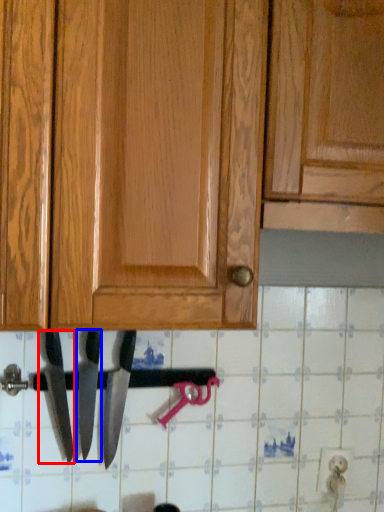
Question: Which of the following is the closest to the observer, knife (highlighted by a red box) or knife (highlighted by a blue box)?

Choices:
 (A) knife
 (B) knife

Answer: (A)